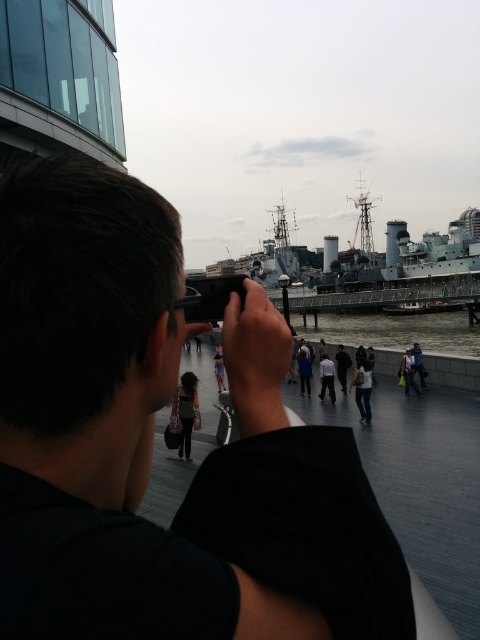
Does silhouette fabric dress at center have a lesser width compared to denim jacket at lower right?

No.

Find the location of a particular element. The width and height of the screenshot is (480, 640). silhouette fabric dress at center is located at coordinates (186, 412).

Where is `silhouette fabric dress at center`? Image resolution: width=480 pixels, height=640 pixels. silhouette fabric dress at center is located at coordinates (186, 412).

Can you confirm if black matte camera at center is taller than white shirt at center?

Indeed, black matte camera at center has a greater height compared to white shirt at center.

Between black matte camera at center and white shirt at center, which one is positioned higher?

black matte camera at center

The height and width of the screenshot is (640, 480). What do you see at coordinates (142, 436) in the screenshot?
I see `black matte camera at center` at bounding box center [142, 436].

The image size is (480, 640). Identify the location of black matte camera at center. (142, 436).

Who is lower down, gray metallic battleship at center or silhouette fabric dress at center?

silhouette fabric dress at center is below.

What do you see at coordinates (400, 272) in the screenshot? I see `gray metallic battleship at center` at bounding box center [400, 272].

Locate an element on the screen. Image resolution: width=480 pixels, height=640 pixels. gray metallic battleship at center is located at coordinates (400, 272).